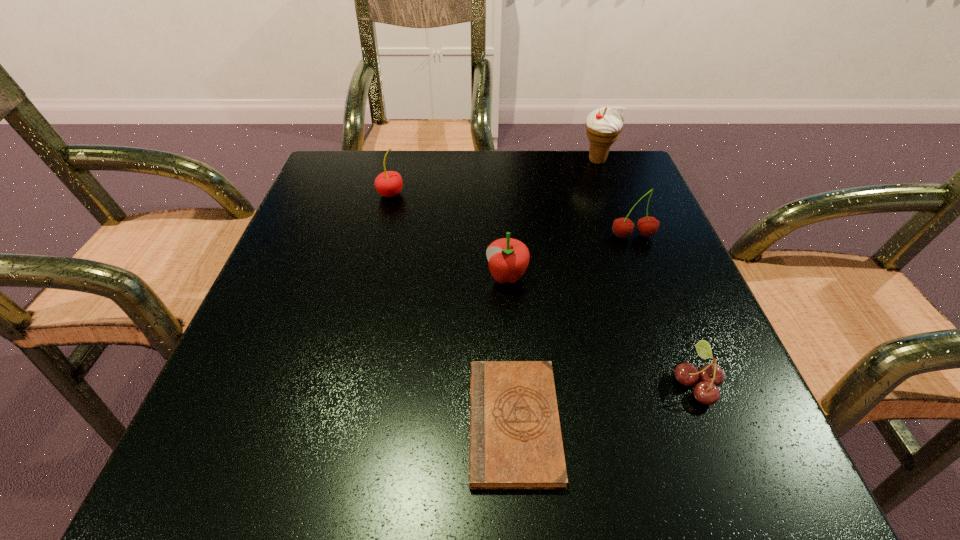
Locate an element on the screen. The height and width of the screenshot is (540, 960). icecream present at the far edge is located at coordinates (604, 125).

Where is `cherry located in the far edge section of the desktop`? Image resolution: width=960 pixels, height=540 pixels. cherry located in the far edge section of the desktop is located at coordinates (389, 183).

This screenshot has width=960, height=540. Identify the location of object situated at the near edge. (515, 442).

Where is `object located in the left edge section of the desktop`? object located in the left edge section of the desktop is located at coordinates (389, 183).

In order to click on icecream that is at the right edge in this screenshot , I will do `click(604, 125)`.

You are a GUI agent. You are given a task and a screenshot of the screen. Output one action in this format:
    pyautogui.click(x=<x>, y=<y>)
    Task: Click on the object present at the far left corner
    Image resolution: width=960 pixels, height=540 pixels.
    Given the screenshot: What is the action you would take?
    pyautogui.click(x=389, y=183)

At what (x,y) coordinates should I click in order to perform the action: click on object at the far right corner. Please return your answer as a coordinate pair (x, y). The width and height of the screenshot is (960, 540). Looking at the image, I should click on pos(604,125).

The image size is (960, 540). Identify the location of free space at the far edge of the desktop. pos(474,163).

You are a GUI agent. You are given a task and a screenshot of the screen. Output one action in this format:
    pyautogui.click(x=<x>, y=<y>)
    Task: Click on the vacant region at the near edge of the desktop
    This screenshot has width=960, height=540.
    Given the screenshot: What is the action you would take?
    pyautogui.click(x=409, y=447)

This screenshot has width=960, height=540. What are the coordinates of `vacant space at the left edge of the desktop` in the screenshot? It's located at (296, 414).